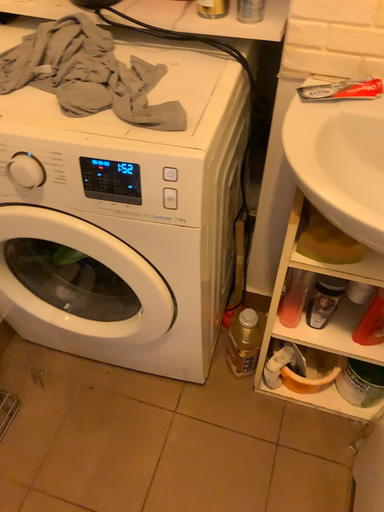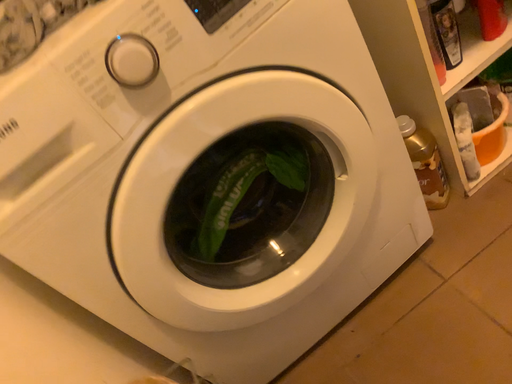
Question: How did the camera likely rotate when shooting the video?

Choices:
 (A) rotated downward
 (B) rotated upward

Answer: (B)